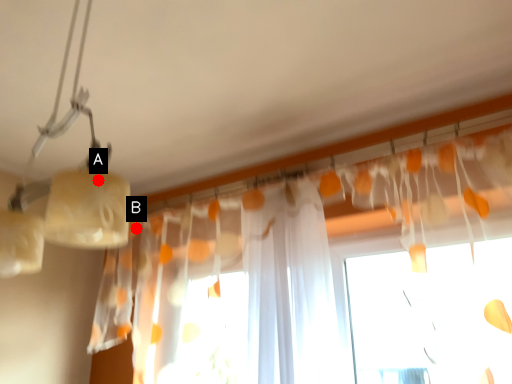
Question: Two points are circled on the image, labeled by A and B beside each circle. Which point is further to the camera?

Choices:
 (A) A is further
 (B) B is further

Answer: (B)